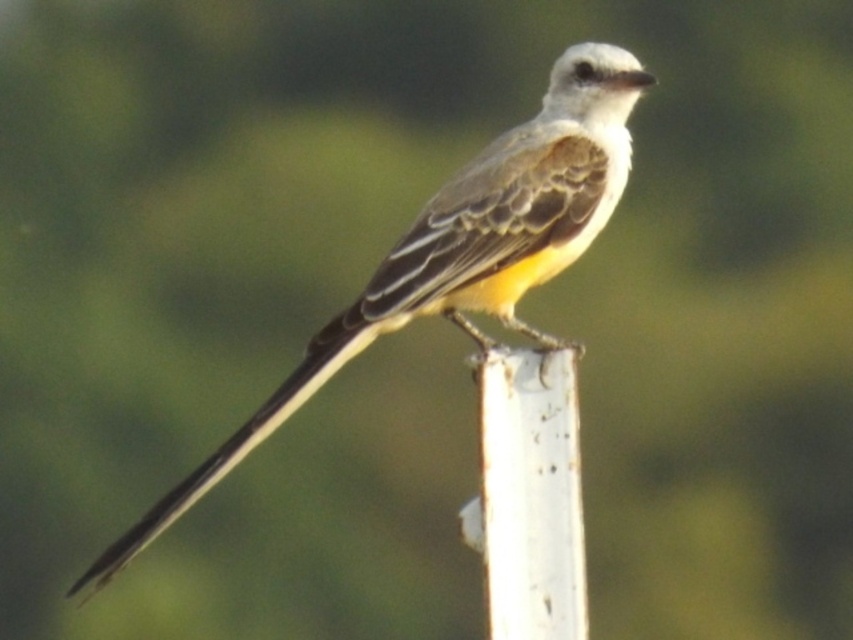
You are a photographer focusing on the bird in the scene. You notice a point marked at coordinates (461, 252). What color feathers can be found at this specific point?

The point at coordinates (461, 252) has yellowish brown feathers.